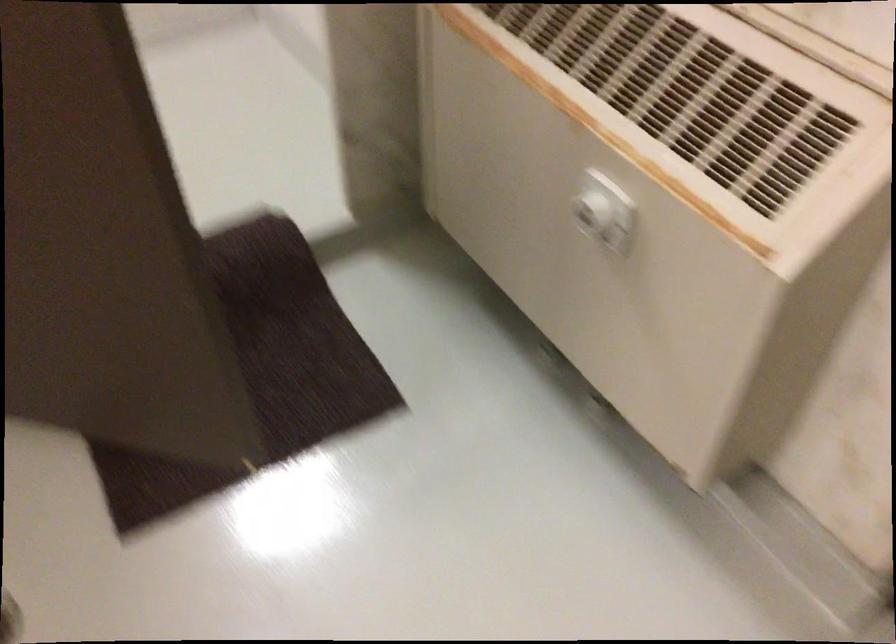
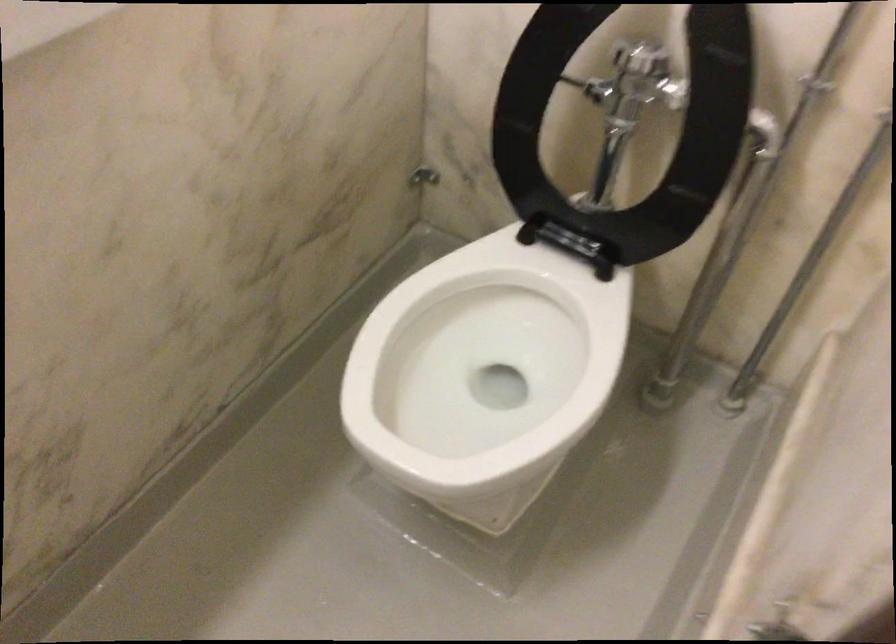
Based on the continuous images, in which direction is the camera rotating?

A: The rotation direction of the camera is left-down.